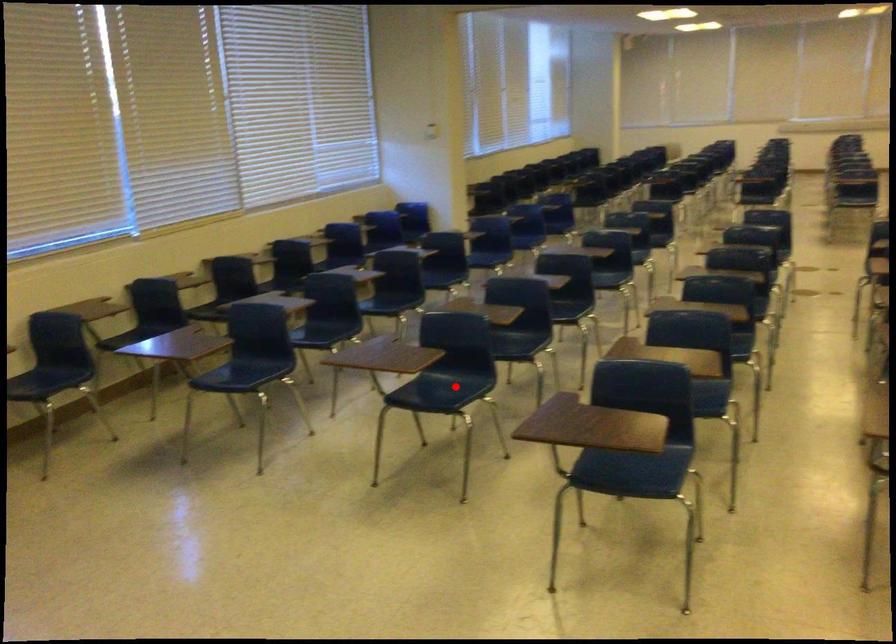
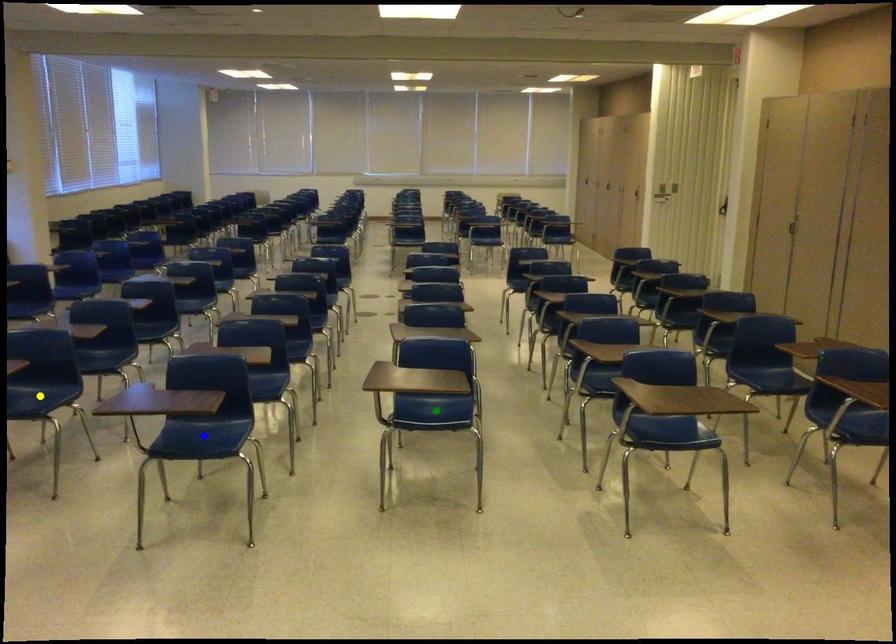
Question: I am providing you with two images of the same scene from different viewpoints. A red point is marked on the first image. You are given multiple points on the second image. Which spot in image 2 lines up with the point in image 1?

Choices:
 (A) yellow point
 (B) blue point
 (C) green point

Answer: (A)